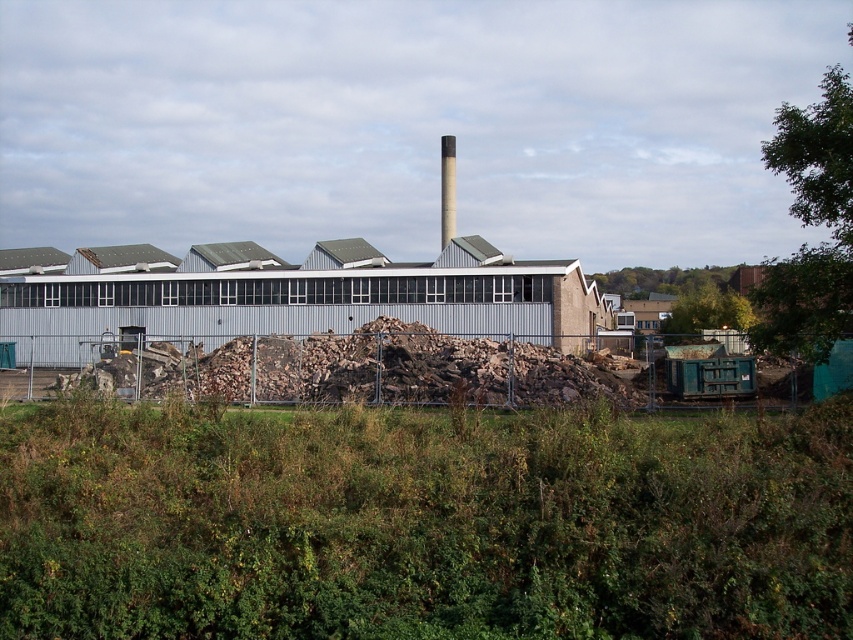
Question: Which point is farther from the camera taking this photo?

Choices:
 (A) (454, 216)
 (B) (451, 364)

Answer: (A)

Question: Which object is the closest to the metallic gray building at center?

Choices:
 (A) smooth gray chimney at center
 (B) brown rough wood at center

Answer: (B)

Question: Does brown rough wood at center appear over smooth gray chimney at center?

Choices:
 (A) no
 (B) yes

Answer: (A)

Question: Which object is closer to the camera taking this photo?

Choices:
 (A) brown rough wood at center
 (B) metallic gray building at center

Answer: (A)

Question: Does brown rough wood at center lie in front of smooth gray chimney at center?

Choices:
 (A) no
 (B) yes

Answer: (B)

Question: Is metallic gray building at center positioned in front of smooth gray chimney at center?

Choices:
 (A) no
 (B) yes

Answer: (B)